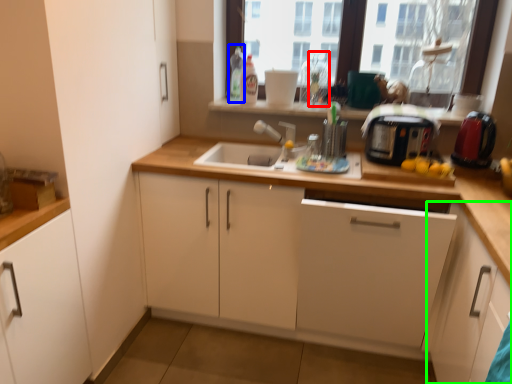
Question: Based on their relative distances, which object is farther from bottle (highlighted by a red box)? Choose from bottle (highlighted by a blue box) and cabinetry (highlighted by a green box).

Choices:
 (A) bottle
 (B) cabinetry

Answer: (B)